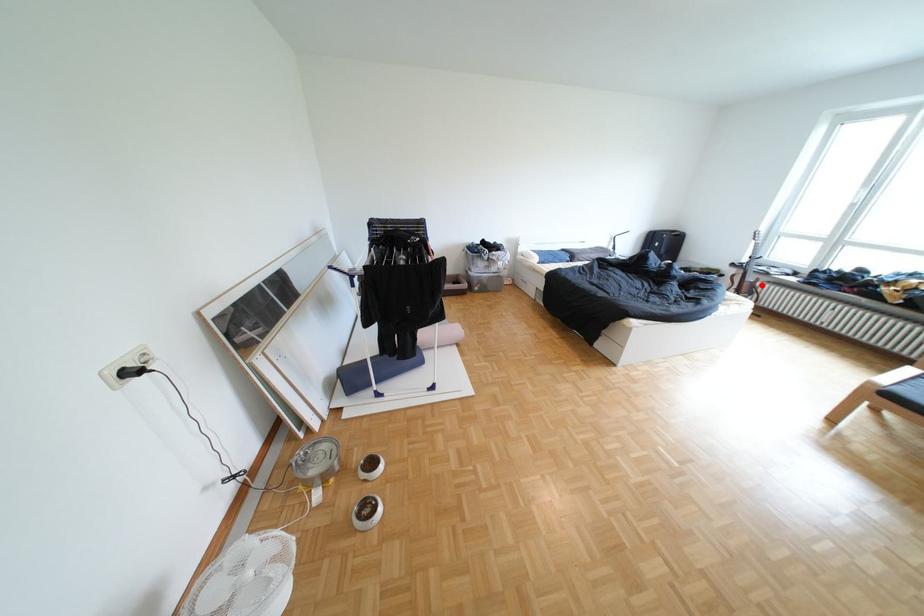
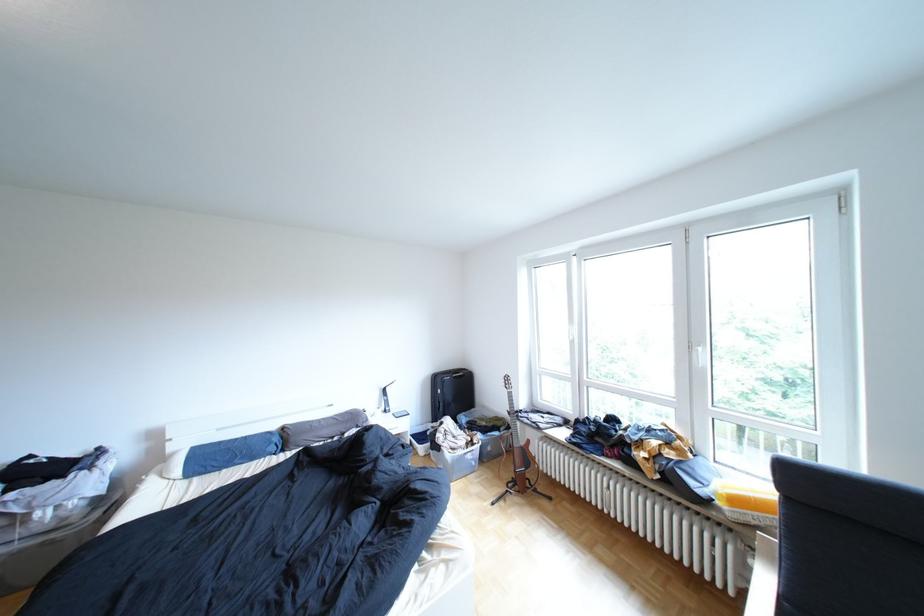
Question: I am providing you with two images of the same scene from different viewpoints. Image1 has a red point marked. In image2, the corresponding 3D location appears at what relative position? Reply with the corresponding letter.

Choices:
 (A) Closer
 (B) Farther

Answer: (B)